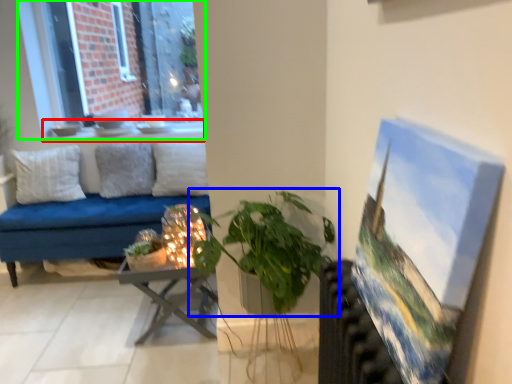
Question: Based on their relative distances, which object is farther from window sill (highlighted by a red box)? Choose from houseplant (highlighted by a blue box) and window (highlighted by a green box).

Choices:
 (A) houseplant
 (B) window

Answer: (A)